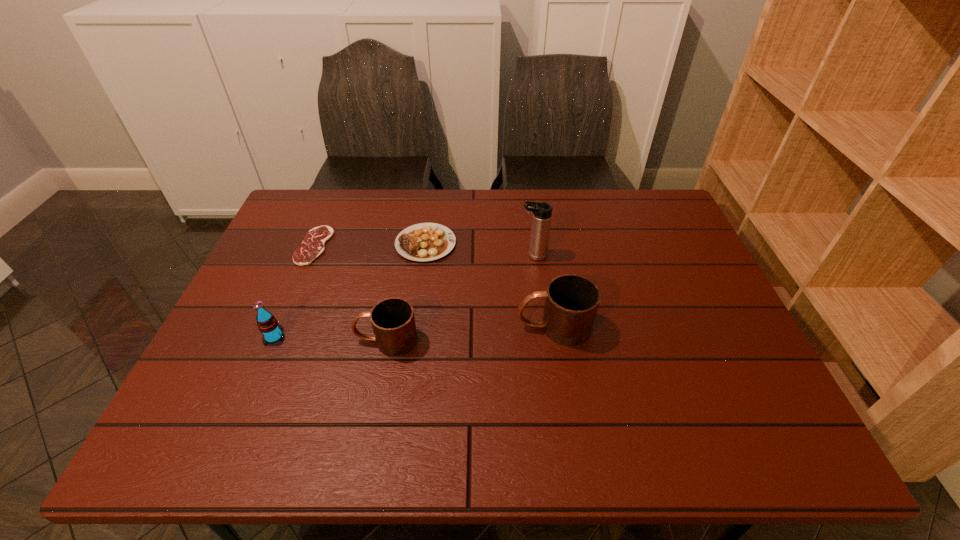
Find the location of `vacant space positioned on the right of the soda`. vacant space positioned on the right of the soda is located at coordinates (359, 337).

Image resolution: width=960 pixels, height=540 pixels. Identify the location of steak located in the left edge section of the desktop. (313, 245).

At what (x,y) coordinates should I click in order to perform the action: click on soda located in the left edge section of the desktop. Please return your answer as a coordinate pair (x, y). This screenshot has height=540, width=960. Looking at the image, I should click on [x=267, y=324].

The image size is (960, 540). Find the location of `object that is at the far left corner`. object that is at the far left corner is located at coordinates (313, 245).

Where is `free spot at the far edge of the desktop`? free spot at the far edge of the desktop is located at coordinates (522, 212).

I want to click on free region at the near edge, so tap(442, 405).

What are the coordinates of `vacant space at the left edge of the desktop` in the screenshot? It's located at click(x=226, y=368).

Where is `free region at the right edge of the desktop`? The width and height of the screenshot is (960, 540). free region at the right edge of the desktop is located at coordinates (704, 373).

At what (x,y) coordinates should I click in order to perform the action: click on blank space at the far left corner. Please return your answer as a coordinate pair (x, y). Looking at the image, I should click on (327, 198).

This screenshot has height=540, width=960. In the image, there is a desktop. What are the coordinates of `vacant space at the near left corner` in the screenshot? It's located at (230, 404).